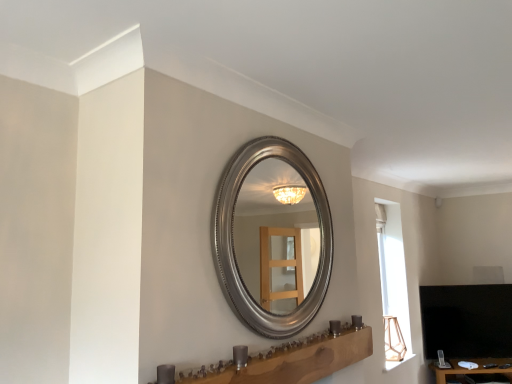
Question: Is wooden vanity at lower center positioned behind wooden table at lower right?

Choices:
 (A) no
 (B) yes

Answer: (A)

Question: Is wooden vanity at lower center positioned with its back to wooden table at lower right?

Choices:
 (A) no
 (B) yes

Answer: (A)

Question: Is wooden table at lower right located within wooden vanity at lower center?

Choices:
 (A) no
 (B) yes

Answer: (A)

Question: Is wooden vanity at lower center taller than wooden table at lower right?

Choices:
 (A) no
 (B) yes

Answer: (A)

Question: From the image's perspective, would you say wooden vanity at lower center is shown under wooden table at lower right?

Choices:
 (A) yes
 (B) no

Answer: (B)

Question: Is wooden vanity at lower center at the right side of wooden table at lower right?

Choices:
 (A) no
 (B) yes

Answer: (A)

Question: Is wooden table at lower right not within wooden vanity at lower center?

Choices:
 (A) no
 (B) yes

Answer: (B)

Question: From a real-world perspective, does wooden table at lower right sit lower than wooden vanity at lower center?

Choices:
 (A) yes
 (B) no

Answer: (A)

Question: Does wooden table at lower right have a smaller size compared to wooden vanity at lower center?

Choices:
 (A) yes
 (B) no

Answer: (B)

Question: From the image's perspective, is wooden table at lower right on top of wooden vanity at lower center?

Choices:
 (A) yes
 (B) no

Answer: (B)

Question: Considering the relative sizes of wooden table at lower right and wooden vanity at lower center in the image provided, is wooden table at lower right thinner than wooden vanity at lower center?

Choices:
 (A) no
 (B) yes

Answer: (A)

Question: Considering the relative positions of wooden table at lower right and wooden vanity at lower center in the image provided, is wooden table at lower right to the left of wooden vanity at lower center from the viewer's perspective?

Choices:
 (A) no
 (B) yes

Answer: (A)

Question: Choose the correct answer: Is wooden table at lower right inside wooden vanity at lower center or outside it?

Choices:
 (A) outside
 (B) inside

Answer: (A)